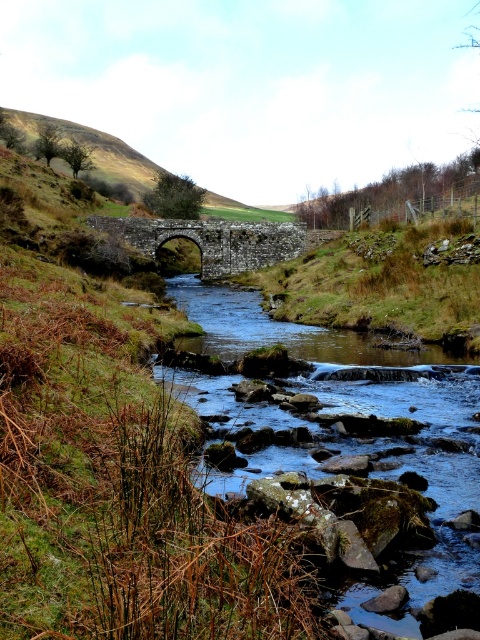
Question: Which point appears closest to the camera in this image?

Choices:
 (A) (211, 260)
 (B) (235, 307)

Answer: (B)

Question: Is clear water at center further to camera compared to stone arch bridge at center?

Choices:
 (A) no
 (B) yes

Answer: (A)

Question: Considering the relative positions of clear water at center and stone arch bridge at center in the image provided, where is clear water at center located with respect to stone arch bridge at center?

Choices:
 (A) above
 (B) below

Answer: (B)

Question: Which point is farther to the camera?

Choices:
 (A) (188, 348)
 (B) (203, 278)

Answer: (B)

Question: Can you confirm if clear water at center is positioned below stone arch bridge at center?

Choices:
 (A) yes
 (B) no

Answer: (A)